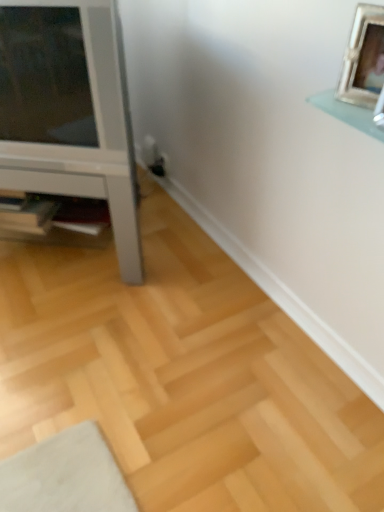
Question: Is wooden shelf at lower left facing away from white glossy tv stand at left?

Choices:
 (A) yes
 (B) no

Answer: (A)

Question: Is wooden shelf at lower left smaller than white glossy tv stand at left?

Choices:
 (A) yes
 (B) no

Answer: (A)

Question: Considering the relative positions of wooden shelf at lower left and white glossy tv stand at left in the image provided, is wooden shelf at lower left in front of white glossy tv stand at left?

Choices:
 (A) yes
 (B) no

Answer: (B)

Question: Is wooden shelf at lower left bigger than white glossy tv stand at left?

Choices:
 (A) yes
 (B) no

Answer: (B)

Question: From the image's perspective, is wooden shelf at lower left above white glossy tv stand at left?

Choices:
 (A) no
 (B) yes

Answer: (A)

Question: From a real-world perspective, is wooden shelf at lower left positioned under white glossy tv stand at left based on gravity?

Choices:
 (A) no
 (B) yes

Answer: (B)

Question: Could you tell me if silver metallic picture frame at upper right is turned towards wooden shelf at lower left?

Choices:
 (A) yes
 (B) no

Answer: (B)

Question: Can wooden shelf at lower left be found inside silver metallic picture frame at upper right?

Choices:
 (A) yes
 (B) no

Answer: (B)

Question: From the image's perspective, is silver metallic picture frame at upper right below wooden shelf at lower left?

Choices:
 (A) no
 (B) yes

Answer: (A)

Question: Is silver metallic picture frame at upper right turned away from wooden shelf at lower left?

Choices:
 (A) no
 (B) yes

Answer: (A)

Question: From a real-world perspective, is silver metallic picture frame at upper right located higher than wooden shelf at lower left?

Choices:
 (A) yes
 (B) no

Answer: (A)

Question: Does silver metallic picture frame at upper right lie behind wooden shelf at lower left?

Choices:
 (A) yes
 (B) no

Answer: (B)

Question: Is wooden shelf at lower left far from silver metallic picture frame at upper right?

Choices:
 (A) yes
 (B) no

Answer: (A)